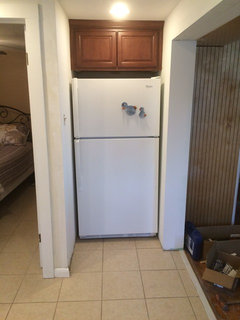
Can you point out all what holds the door onto frame in this image? Your answer should be formatted as a list of tuples, i.e. [(x1, y1), (x2, y2), ...], where each tuple contains the x and y coordinates of a point satisfying the conditions above.

[(26, 62), (38, 238)]